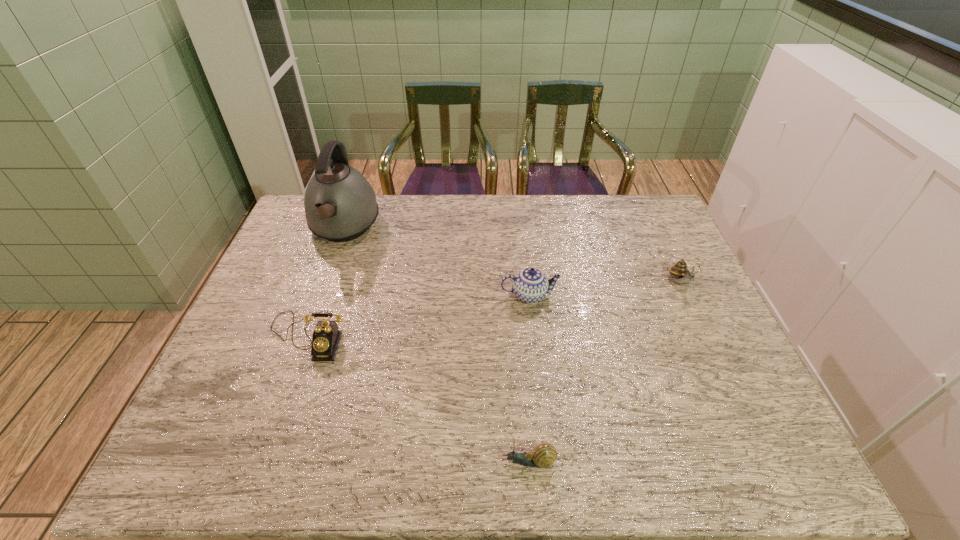
Image resolution: width=960 pixels, height=540 pixels. I want to click on object positioned at the far left corner, so click(x=340, y=205).

The width and height of the screenshot is (960, 540). In the image, there is a desktop. What are the coordinates of `vacant space at the far edge` in the screenshot? It's located at (598, 205).

Locate an element on the screen. The width and height of the screenshot is (960, 540). free space at the near edge of the desktop is located at coordinates coord(407,468).

Image resolution: width=960 pixels, height=540 pixels. In the image, there is a desktop. What are the coordinates of `vacant space at the left edge` in the screenshot? It's located at (242, 413).

In the image, there is a desktop. At what (x,y) coordinates should I click in order to perform the action: click on vacant space at the far right corner. Please return your answer as a coordinate pair (x, y). Looking at the image, I should click on (664, 221).

Where is `vacant space at the near right corner`? vacant space at the near right corner is located at coordinates (718, 452).

Locate an element on the screen. empty space that is in between the right escargot and the chinaware is located at coordinates (605, 289).

Identify the location of vacant region between the kettle and the chinaware. 437,262.

Locate an element on the screen. free space that is in between the farther escargot and the left escargot is located at coordinates (605, 372).

In order to click on vacant space that is in between the nearest object and the taller escargot in this screenshot , I will do `click(605, 372)`.